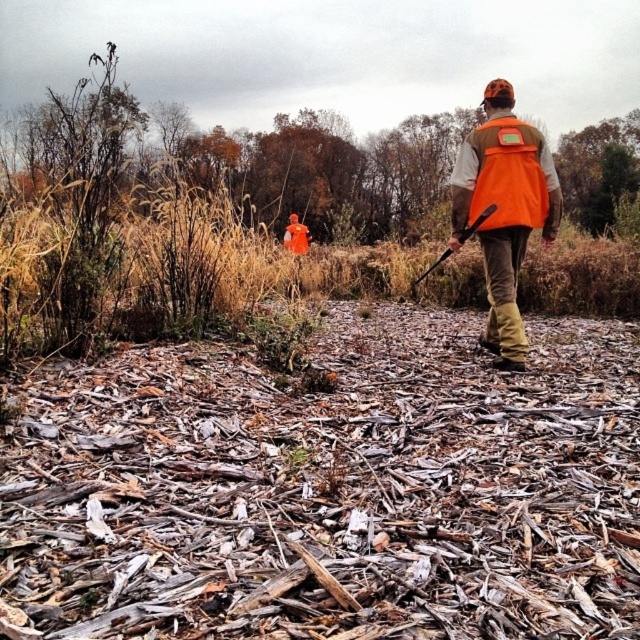
You are a photographer positioned at the camera location. You want to capture a clear photo of the orange fabric vest at center. Considering the distance, will you need to use a zoom lens to focus on it?

The orange fabric vest at center is 14.07 feet away from the camera. A zoom lens would help in focusing on the orange fabric vest at center from that distance.

You are a photographer positioned at the camera location. You want to take a photo that includes both the point at (541, 152) and the point at (545, 221). Which point will appear larger in your photo?

Point at (541, 152) will appear larger in the photo because it is closer to the camera than point at (545, 221).